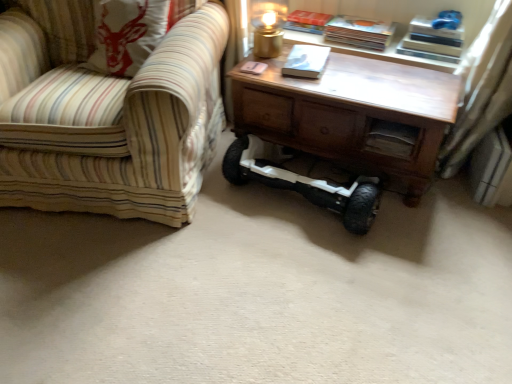
The width and height of the screenshot is (512, 384). I want to click on vacant area situated to the left side of white matte hoverboard at center, so click(x=205, y=226).